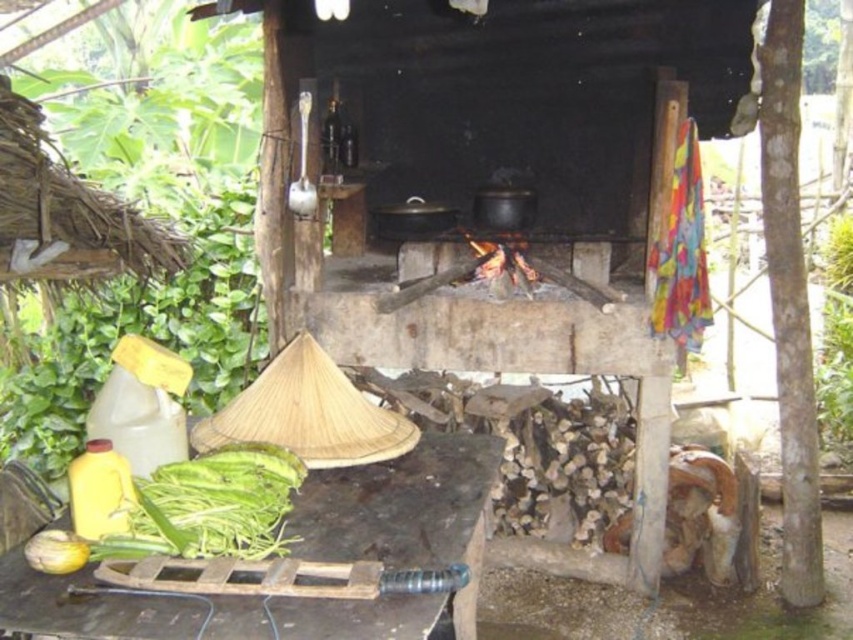
Between wooden table at lower left and green leafy vegetables at lower left, which one appears on the right side from the viewer's perspective?

wooden table at lower left is more to the right.

Which of these two, wooden table at lower left or green leafy vegetables at lower left, stands shorter?

green leafy vegetables at lower left

The image size is (853, 640). In order to click on wooden table at lower left in this screenshot , I will do `click(393, 538)`.